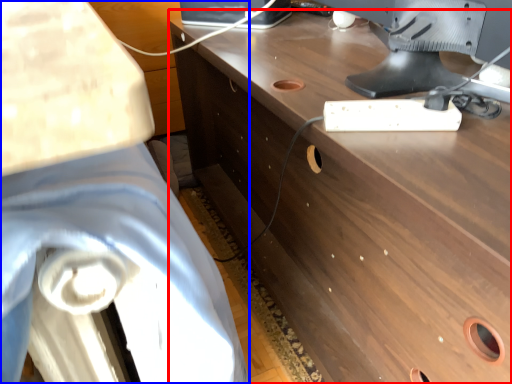
Question: Which of the following is the closest to the observer, desk (highlighted by a red box) or swivel chair (highlighted by a blue box)?

Choices:
 (A) desk
 (B) swivel chair

Answer: (B)